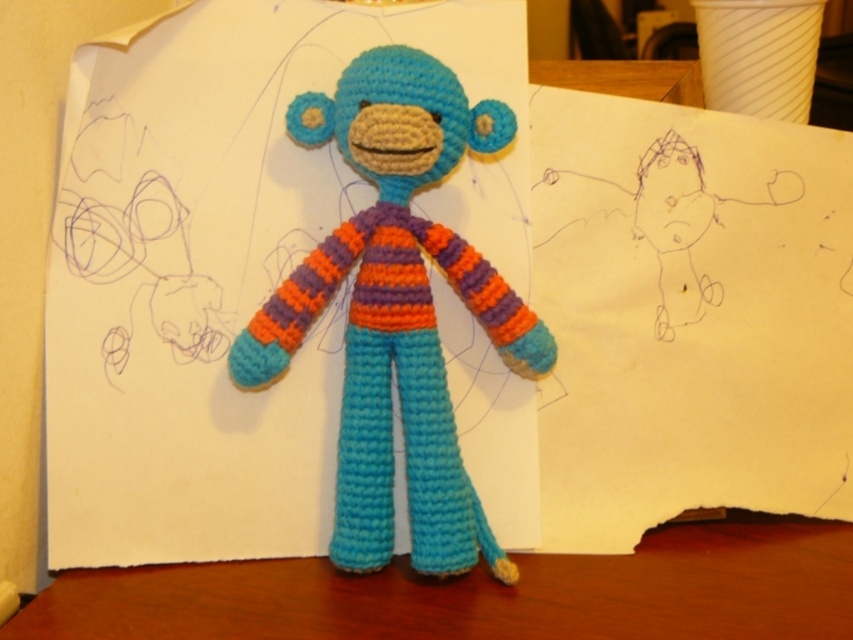
Is knitted yarn monkey at center smaller than wooden table at center?

Actually, knitted yarn monkey at center might be larger than wooden table at center.

How distant is knitted yarn monkey at center from wooden table at center?

knitted yarn monkey at center and wooden table at center are 12.30 inches apart.

Who is more distant from viewer, (380,100) or (82,589)?

Result: The point (380,100) is behind.

Find the location of a particular element. The image size is (853, 640). knitted yarn monkey at center is located at coordinates (397, 310).